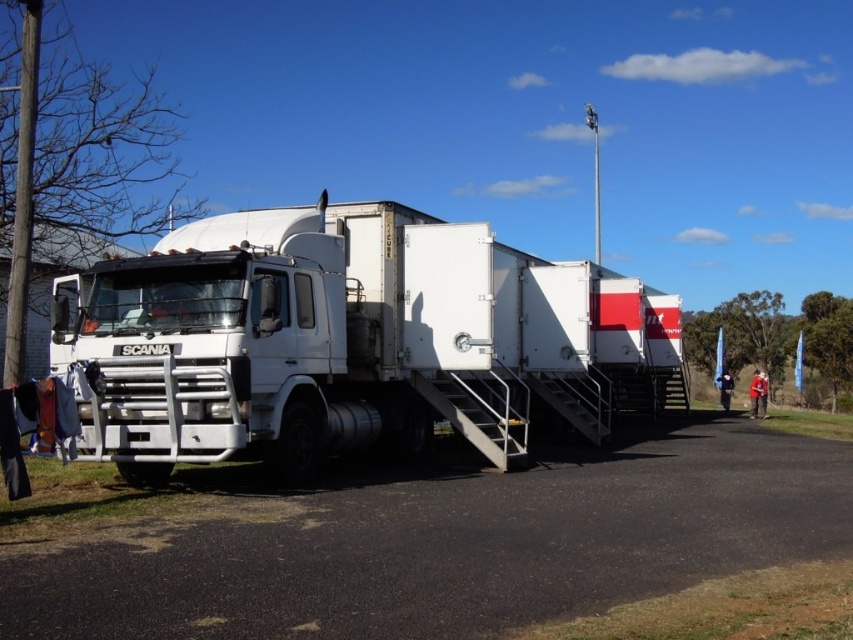
Question: From the image, what is the correct spatial relationship of white matte trailer truck at center in relation to black asphalt at lower center?

Choices:
 (A) right
 (B) left

Answer: (B)

Question: Can you confirm if white matte trailer truck at center is wider than black asphalt at lower center?

Choices:
 (A) no
 (B) yes

Answer: (B)

Question: Observing the image, what is the correct spatial positioning of white matte trailer truck at center in reference to black asphalt at lower center?

Choices:
 (A) right
 (B) left

Answer: (B)

Question: Among these points, which one is nearest to the camera?

Choices:
 (A) (425, 532)
 (B) (165, 360)

Answer: (A)

Question: Which of the following is the farthest from the observer?

Choices:
 (A) black asphalt at lower center
 (B) white matte trailer truck at center

Answer: (B)